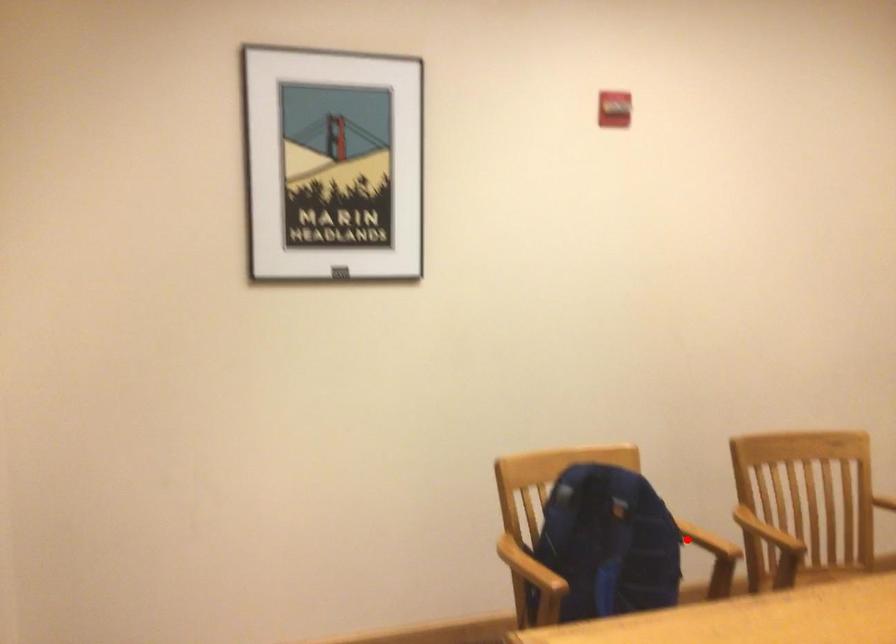
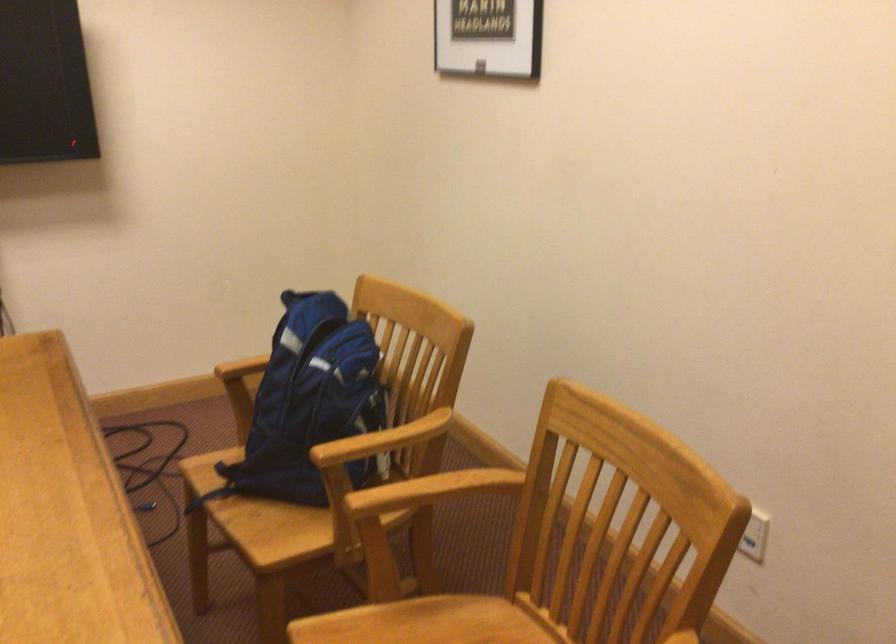
The point at the highlighted location is marked in the first image. Where is the corresponding point in the second image?

(383, 440)